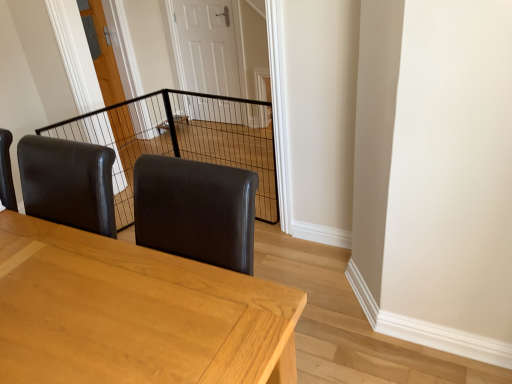
Question: Does wooden door at center, the first door positioned from the left, appear on the left side of white glossy door at center, the first door positioned from the right?

Choices:
 (A) yes
 (B) no

Answer: (A)

Question: Is wooden door at center, the second door from the right, further to camera compared to white glossy door at center, the first door positioned from the right?

Choices:
 (A) no
 (B) yes

Answer: (A)

Question: Is wooden door at center, the second door from the right, oriented away from white glossy door at center, the first door positioned from the right?

Choices:
 (A) no
 (B) yes

Answer: (A)

Question: From the image's perspective, is wooden door at center, the first door positioned from the left, located above white glossy door at center, the first door positioned from the right?

Choices:
 (A) yes
 (B) no

Answer: (B)

Question: Can you confirm if wooden door at center, the second door from the right, is shorter than white glossy door at center, which appears as the second door when viewed from the left?

Choices:
 (A) yes
 (B) no

Answer: (B)

Question: Is white glossy door at center, the first door positioned from the right, situated inside light brown wooden table at center or outside?

Choices:
 (A) outside
 (B) inside

Answer: (A)

Question: In terms of height, does white glossy door at center, which appears as the second door when viewed from the left, look taller or shorter compared to light brown wooden table at center?

Choices:
 (A) tall
 (B) short

Answer: (A)

Question: Considering the positions of white glossy door at center, the first door positioned from the right, and light brown wooden table at center in the image, is white glossy door at center, the first door positioned from the right, bigger or smaller than light brown wooden table at center?

Choices:
 (A) small
 (B) big

Answer: (A)

Question: From the image's perspective, is white glossy door at center, which appears as the second door when viewed from the left, located above or below light brown wooden table at center?

Choices:
 (A) above
 (B) below

Answer: (A)

Question: Is black wire mesh at center spatially inside light brown wooden table at center, or outside of it?

Choices:
 (A) inside
 (B) outside

Answer: (B)

Question: Is black wire mesh at center wider or thinner than light brown wooden table at center?

Choices:
 (A) wide
 (B) thin

Answer: (B)

Question: Relative to light brown wooden table at center, is black wire mesh at center in front or behind?

Choices:
 (A) behind
 (B) front

Answer: (A)

Question: Considering the positions of black wire mesh at center and light brown wooden table at center in the image, is black wire mesh at center taller or shorter than light brown wooden table at center?

Choices:
 (A) tall
 (B) short

Answer: (B)

Question: Looking at their shapes, would you say black wire mesh at center is wider or thinner than white glossy door at center, the first door positioned from the right?

Choices:
 (A) wide
 (B) thin

Answer: (A)

Question: Based on their sizes in the image, would you say black wire mesh at center is bigger or smaller than white glossy door at center, the first door positioned from the right?

Choices:
 (A) big
 (B) small

Answer: (A)